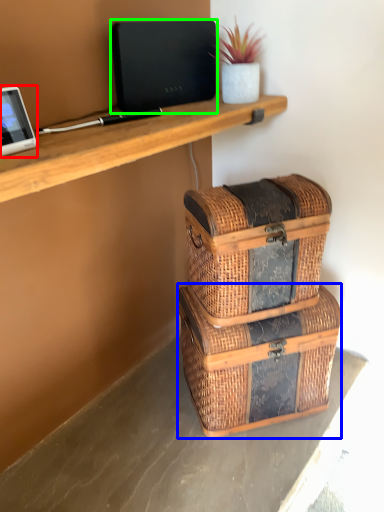
Question: Which object is the farthest from tablet computer (highlighted by a red box)? Choose among these: storage box (highlighted by a blue box) or laptop (highlighted by a green box).

Choices:
 (A) storage box
 (B) laptop

Answer: (A)